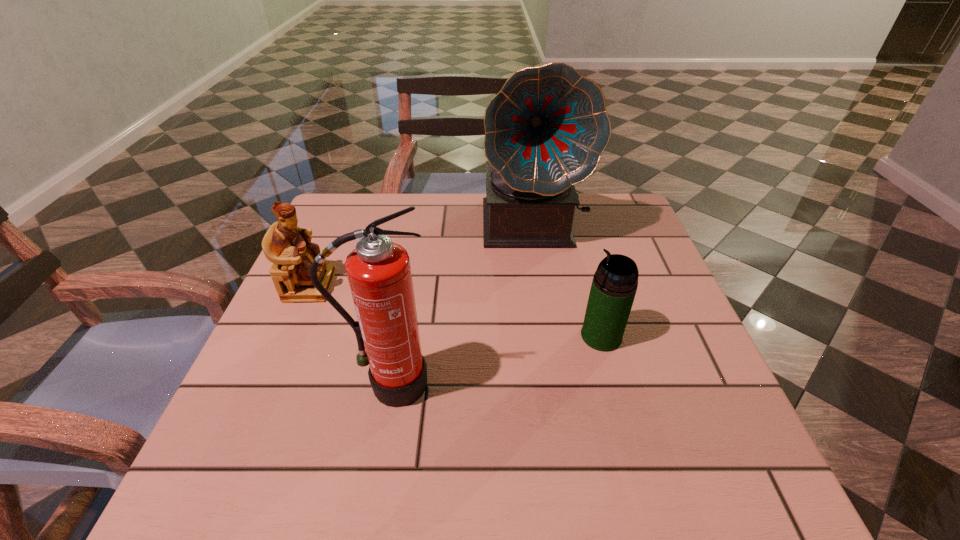
Image resolution: width=960 pixels, height=540 pixels. I want to click on record player, so click(545, 131).

Identify the location of the nearest object. pyautogui.click(x=379, y=274).

Identify the location of the third object from right to left. Image resolution: width=960 pixels, height=540 pixels. (379, 274).

You are a GUI agent. You are given a task and a screenshot of the screen. Output one action in this format:
    pyautogui.click(x=<x>, y=<y>)
    Task: Click on the third farthest object
    
    Given the screenshot: What is the action you would take?
    pyautogui.click(x=615, y=282)

Image resolution: width=960 pixels, height=540 pixels. Identify the location of the second farthest object. (289, 248).

Where is `figurine`? The image size is (960, 540). figurine is located at coordinates (289, 248).

Find the location of a particular element. free spot located 0.240m on the horn of the record player is located at coordinates (550, 331).

Locate an element on the screen. vacant region located on the front-facing side of the second object from left to right is located at coordinates (376, 460).

At what (x,y) coordinates should I click in order to perform the action: click on vacant space located from the spout of the thermos bottle. Please return your answer as a coordinate pair (x, y). Looking at the image, I should click on (405, 336).

Locate an element on the screen. The height and width of the screenshot is (540, 960). vacant space situated from the spout of the thermos bottle is located at coordinates (551, 336).